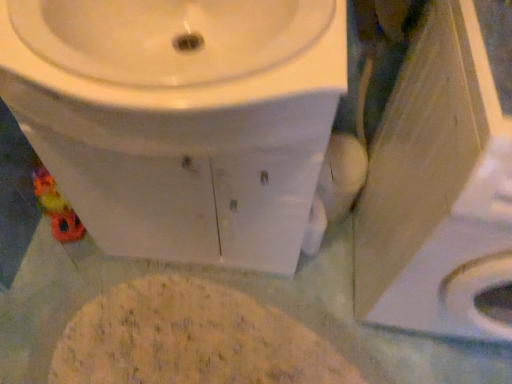
Question: Does white glossy toilet at center have a lesser width compared to white glossy sink at upper center?

Choices:
 (A) no
 (B) yes

Answer: (B)

Question: Is white glossy toilet at center at the right side of white glossy sink at upper center?

Choices:
 (A) yes
 (B) no

Answer: (B)

Question: Does white glossy toilet at center have a lesser height compared to white glossy sink at upper center?

Choices:
 (A) no
 (B) yes

Answer: (A)

Question: Is white glossy toilet at center positioned with its back to white glossy sink at upper center?

Choices:
 (A) yes
 (B) no

Answer: (B)

Question: Is white glossy sink at upper center a part of white glossy toilet at center?

Choices:
 (A) no
 (B) yes

Answer: (B)

Question: In the image, is white glossy toilet at center positioned in front of or behind yellowish powder at center?

Choices:
 (A) behind
 (B) front

Answer: (B)

Question: Considering the positions of white glossy toilet at center and yellowish powder at center in the image, is white glossy toilet at center wider or thinner than yellowish powder at center?

Choices:
 (A) wide
 (B) thin

Answer: (A)

Question: From the image's perspective, is white glossy toilet at center positioned above or below yellowish powder at center?

Choices:
 (A) above
 (B) below

Answer: (A)

Question: In terms of size, does white glossy toilet at center appear bigger or smaller than yellowish powder at center?

Choices:
 (A) small
 (B) big

Answer: (B)

Question: Is point (214, 39) positioned closer to the camera than point (248, 140)?

Choices:
 (A) farther
 (B) closer

Answer: (A)

Question: Considering their positions, is white glossy sink at upper center located in front of or behind white glossy toilet at center?

Choices:
 (A) front
 (B) behind

Answer: (A)

Question: Considering the positions of white glossy sink at upper center and white glossy toilet at center in the image, is white glossy sink at upper center bigger or smaller than white glossy toilet at center?

Choices:
 (A) big
 (B) small

Answer: (B)

Question: Considering the positions of white glossy sink at upper center and white glossy toilet at center in the image, is white glossy sink at upper center taller or shorter than white glossy toilet at center?

Choices:
 (A) short
 (B) tall

Answer: (A)

Question: Considering the positions of point (129, 11) and point (197, 324), is point (129, 11) closer or farther from the camera than point (197, 324)?

Choices:
 (A) farther
 (B) closer

Answer: (B)

Question: From the image's perspective, is white glossy sink at upper center positioned above or below yellowish powder at center?

Choices:
 (A) above
 (B) below

Answer: (A)